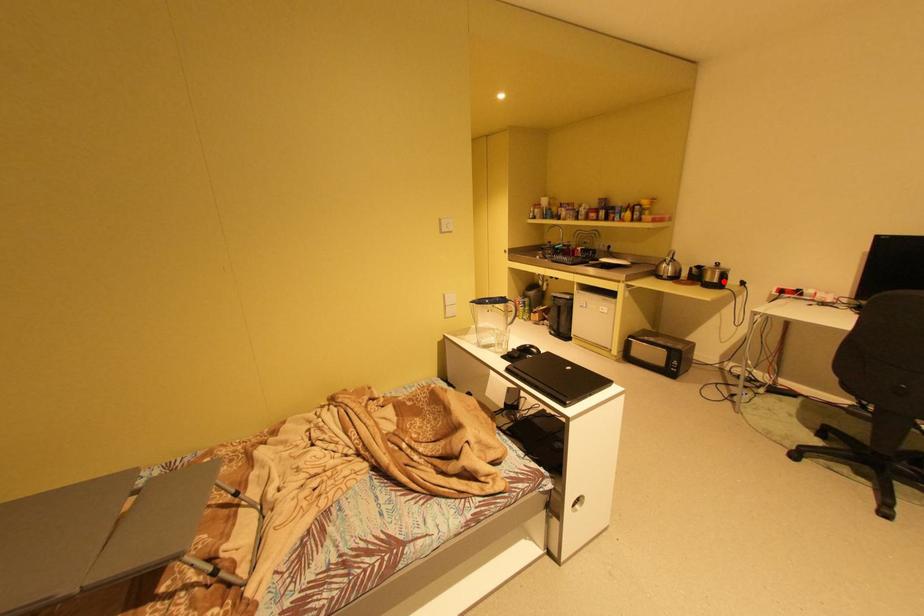
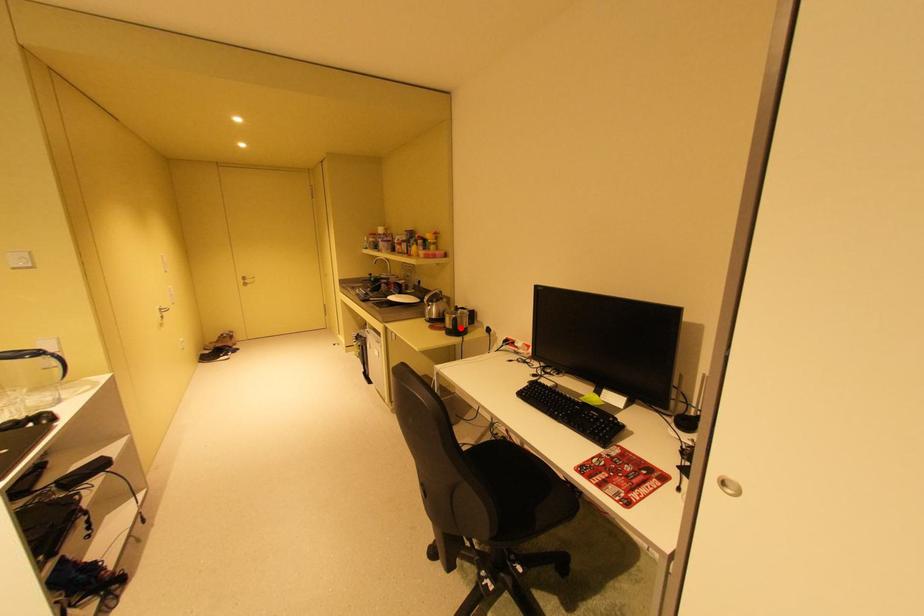
I am providing you with two images of the same scene from different viewpoints. A red point is marked on the first image and another point is marked on the second image. Do the highlighted points in image1 and image2 indicate the same real-world spot?

Yes